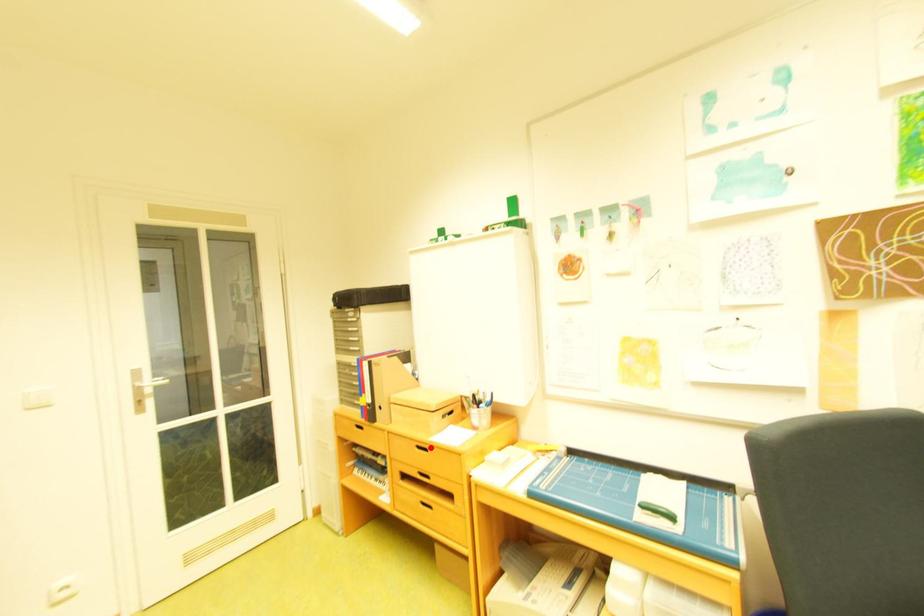
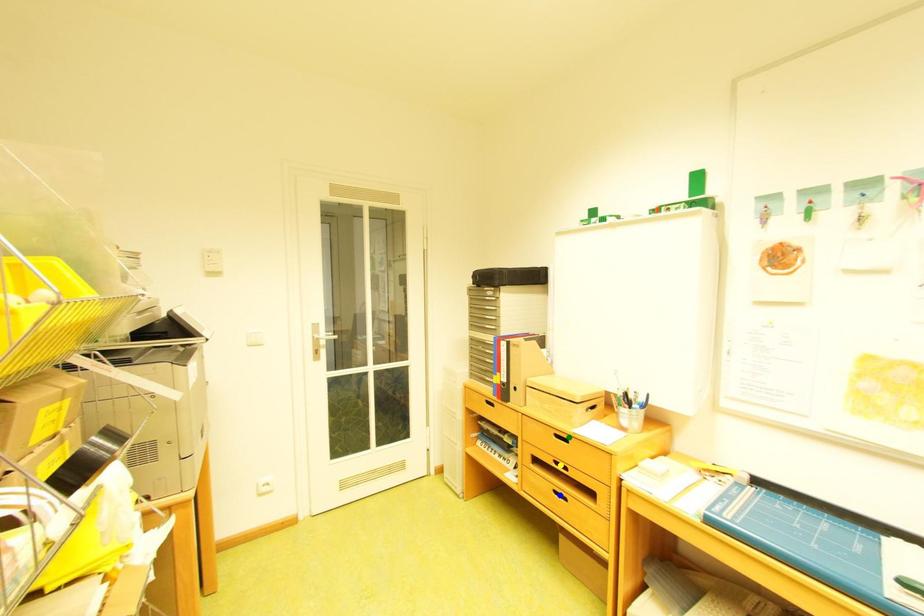
Question: I am providing you with two images of the same scene from different viewpoints. A red point is marked on the first image. You are given multiple points on the second image. Which mark in image 2 goes with the point in image 1?

Choices:
 (A) green point
 (B) yellow point
 (C) blue point

Answer: (A)